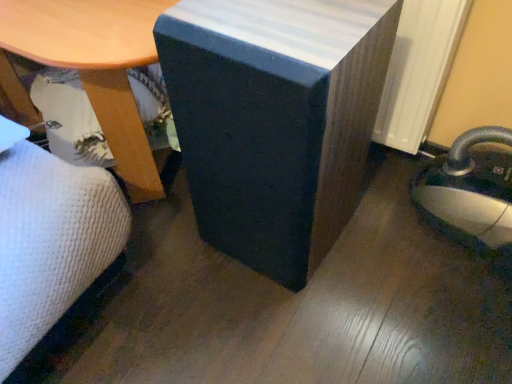
What do you see at coordinates (275, 120) in the screenshot? The image size is (512, 384). I see `matte black speaker at center` at bounding box center [275, 120].

Image resolution: width=512 pixels, height=384 pixels. Identify the location of matte black speaker at center. (275, 120).

Find the location of a particular element. matte black speaker at center is located at coordinates (275, 120).